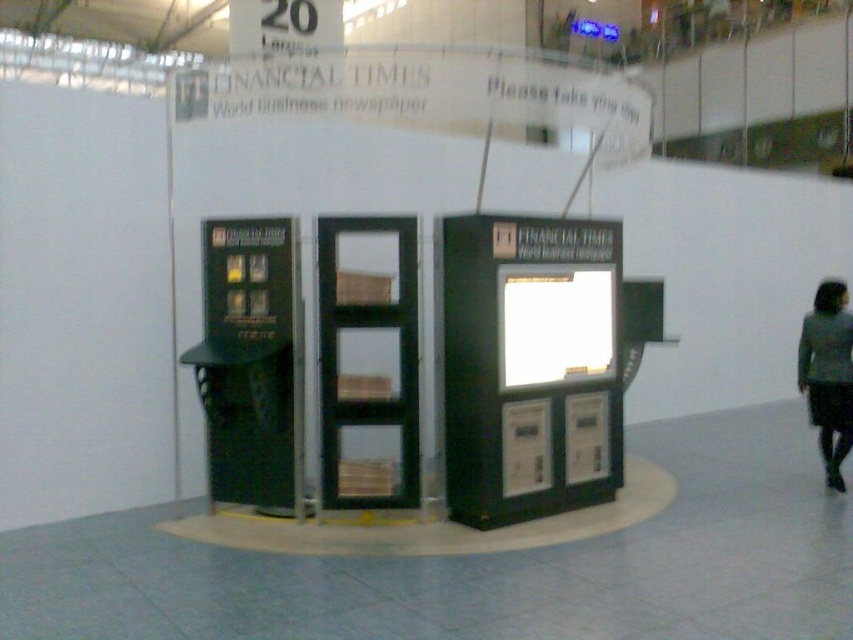
You are standing at the entrance of the convention center and want to locate the Financial Times newspaper booth. According to the image, where is the matte black vending machine at center located in relation to the booth?

The matte black vending machine at center is positioned at coordinates point (529, 365), which is at the center of the image, so it is likely located at the same position as the Financial Times newspaper booth.

You are a visitor at the exhibition hall and want to know if you can place the gray fabric skirt at lower right on top of the matte black vending machine at center. Based on their sizes, is this possible?

The matte black vending machine at center is much taller than the gray fabric skirt at lower right, so placing the gray fabric skirt at lower right on top of it would be physically possible as the vending machine is taller and provides a stable base.

You are a visitor at the exhibition hall and want to approach the matte black vending machine at center to get a newspaper. However, there is a gray fabric skirt at lower right in your path. Can you walk straight to the vending machine without stepping over or around the skirt?

The matte black vending machine at center is closer to the viewer than the gray fabric skirt at lower right, so the skirt is behind the vending machine. Therefore, you can walk straight to the vending machine without needing to step over or around the skirt.